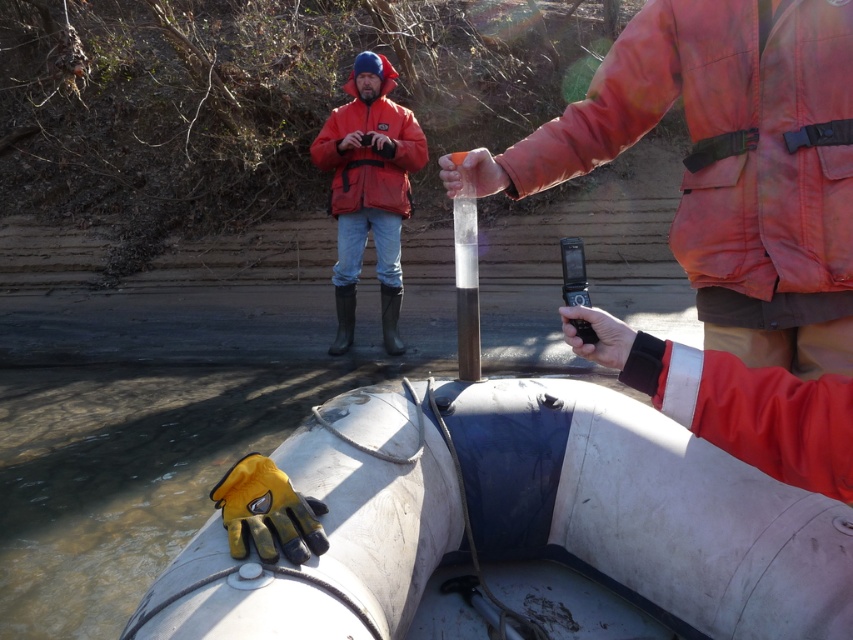
Can you confirm if white rubber boat at lower center is thinner than matte orange jacket at center?

Incorrect, white rubber boat at lower center's width is not less than matte orange jacket at center's.

Can you confirm if white rubber boat at lower center is bigger than matte orange jacket at center?

Indeed, white rubber boat at lower center has a larger size compared to matte orange jacket at center.

Is point (292, 634) more distant than point (357, 192)?

No, (292, 634) is in front of (357, 192).

Locate an element on the screen. This screenshot has height=640, width=853. white rubber boat at lower center is located at coordinates (509, 525).

Between white rubber boat at lower center and orange matte jacket at upper right, which one is positioned higher?

orange matte jacket at upper right is above.

Which is more to the left, white rubber boat at lower center or orange matte jacket at upper right?

From the viewer's perspective, white rubber boat at lower center appears more on the left side.

Which is in front, point (680, 625) or point (827, 243)?

Point (827, 243) is in front.

This screenshot has height=640, width=853. I want to click on white rubber boat at lower center, so click(x=509, y=525).

Can you confirm if orange matte jacket at upper right is smaller than matte orange jacket at center?

Correct, orange matte jacket at upper right occupies less space than matte orange jacket at center.

Is orange matte jacket at upper right bigger than matte orange jacket at center?

Actually, orange matte jacket at upper right might be smaller than matte orange jacket at center.

Image resolution: width=853 pixels, height=640 pixels. Describe the element at coordinates (724, 134) in the screenshot. I see `orange matte jacket at upper right` at that location.

Image resolution: width=853 pixels, height=640 pixels. Identify the location of orange matte jacket at upper right. [724, 134].